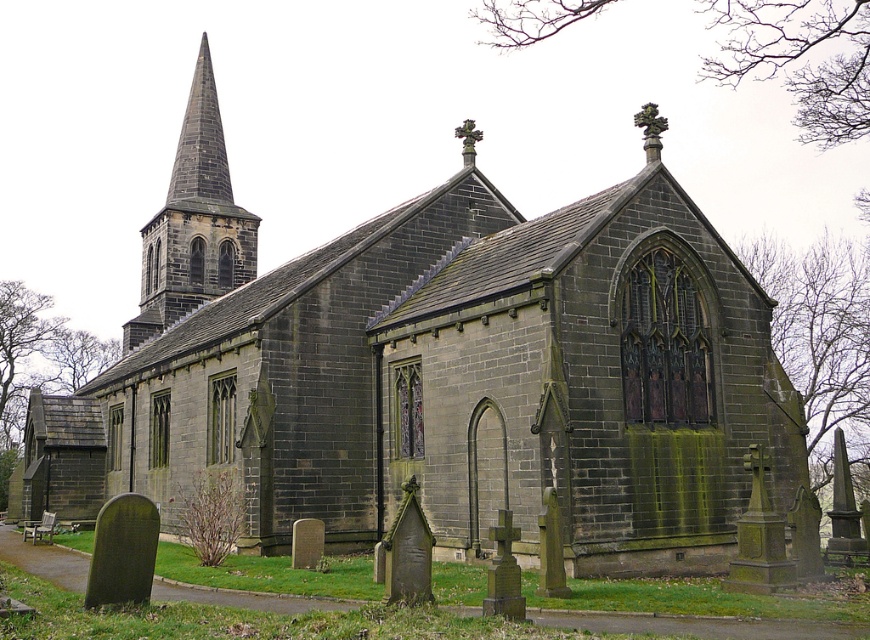
You are a photographer planning to take a wide shot of the church. You want to ensure both the dark gray stone steeple at upper left and the carved stone cross at upper center are fully visible in the frame. Based on their positions and sizes, do you think the steeple might block the cross from view?

The dark gray stone steeple at upper left might be wider than the carved stone cross at upper center, so there is a possibility that the steeple could block part of the cross if positioned directly in front of it. Adjust your angle to ensure both are visible.

You are standing in front of the historic stone church and want to take a photo that includes both the dark gray stone steeple at upper left and the carved stone cross at upper center. Which object should you position closer to the top of your camera frame?

The dark gray stone steeple at upper left is taller than the carved stone cross at upper center, so you should position the dark gray stone steeple at upper left closer to the top of your camera frame to capture its full height.

You are standing in front of the historic stone church and want to take a photo that includes both the dark gray stone steeple at upper left and the carved stone cross at upper center. Which object should you position closer to the front of your camera frame to ensure both are in focus?

You should position the dark gray stone steeple at upper left closer to the front of your camera frame since it is closer to you than the carved stone cross at upper center. This will help ensure both are in focus as they are at different distances from the camera.